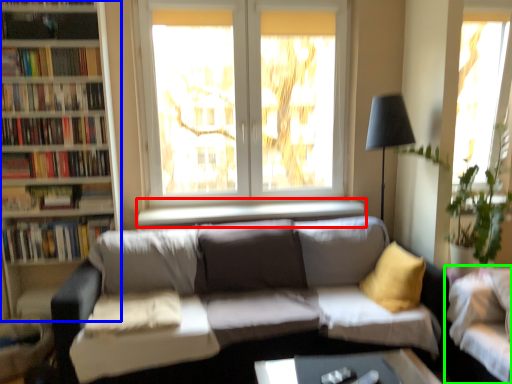
Question: Estimate the real-world distances between objects in this image. Which object is closer to window sill (highlighted by a red box), bookcase (highlighted by a blue box) or studio couch (highlighted by a green box)?

Choices:
 (A) bookcase
 (B) studio couch

Answer: (A)